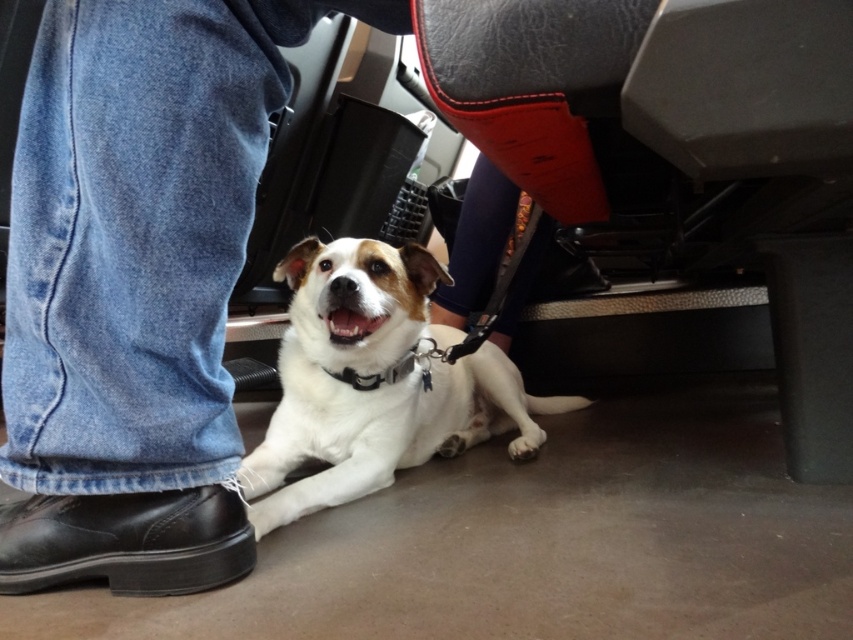
Is white fur dog at center taller than black leather shoe at lower left?

Indeed, white fur dog at center has a greater height compared to black leather shoe at lower left.

Who is taller, white fur dog at center or black leather shoe at lower left?

Standing taller between the two is white fur dog at center.

Is point (392, 268) positioned after point (198, 502)?

Yes, it is.

You are a GUI agent. You are given a task and a screenshot of the screen. Output one action in this format:
    pyautogui.click(x=<x>, y=<y>)
    Task: Click on the white fur dog at center
    
    Given the screenshot: What is the action you would take?
    pyautogui.click(x=375, y=381)

Based on the photo, is jeans at lower left wider than white fur dog at center?

Incorrect, jeans at lower left's width does not surpass white fur dog at center's.

Between point (112, 280) and point (323, 410), which one is positioned in front?

Point (112, 280) is more forward.

Image resolution: width=853 pixels, height=640 pixels. Find the location of `jeans at lower left`. jeans at lower left is located at coordinates (136, 284).

Can you confirm if jeans at lower left is thinner than black leather shoe at lower left?

Incorrect, jeans at lower left's width is not less than black leather shoe at lower left's.

Is jeans at lower left bigger than black leather shoe at lower left?

Correct, jeans at lower left is larger in size than black leather shoe at lower left.

Who is more forward, [109,570] or [165,572]?

Point [165,572] is in front.

Identify the location of jeans at lower left. This screenshot has height=640, width=853. (136, 284).